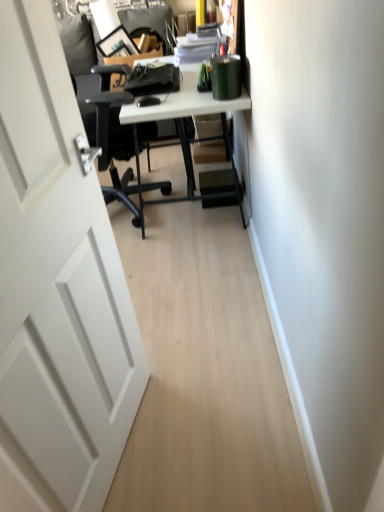
Question: Considering the positions of white glossy desk at center and white matte door at left in the image, is white glossy desk at center bigger or smaller than white matte door at left?

Choices:
 (A) big
 (B) small

Answer: (A)

Question: From the image's perspective, is white glossy desk at center positioned above or below white matte door at left?

Choices:
 (A) above
 (B) below

Answer: (A)

Question: Is white glossy desk at center taller or shorter than white matte door at left?

Choices:
 (A) tall
 (B) short

Answer: (B)

Question: In terms of size, does white matte door at left appear bigger or smaller than white glossy desk at center?

Choices:
 (A) big
 (B) small

Answer: (B)

Question: Considering the positions of white matte door at left and white glossy desk at center in the image, is white matte door at left taller or shorter than white glossy desk at center?

Choices:
 (A) tall
 (B) short

Answer: (A)

Question: Is white matte door at left situated inside white glossy desk at center or outside?

Choices:
 (A) inside
 (B) outside

Answer: (B)

Question: Looking at their shapes, would you say white matte door at left is wider or thinner than white glossy desk at center?

Choices:
 (A) wide
 (B) thin

Answer: (B)